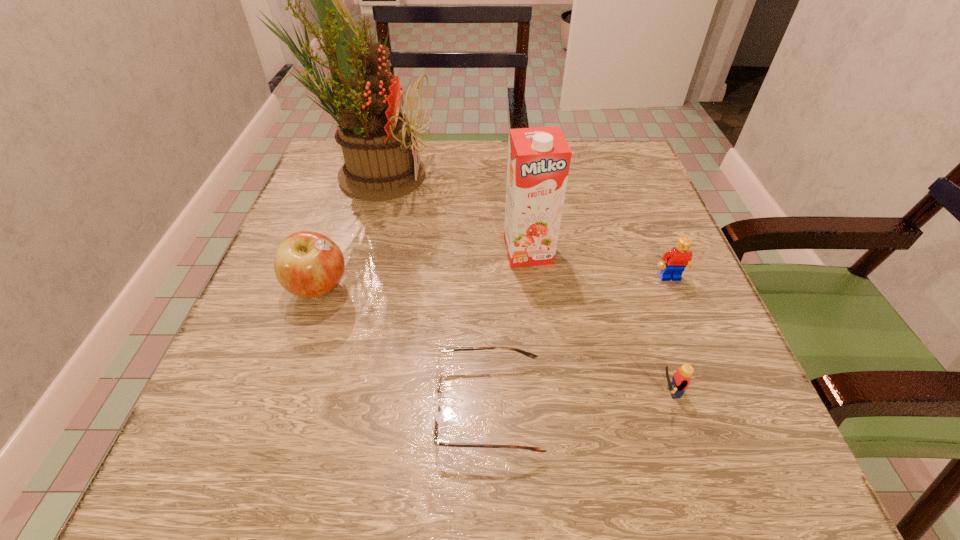
What are the coordinates of `object that is at the near edge` in the screenshot? It's located at 436,410.

Where is `flower arrangement at the left edge`? This screenshot has height=540, width=960. flower arrangement at the left edge is located at coordinates click(376, 138).

The image size is (960, 540). In order to click on apple that is at the left edge in this screenshot , I will do `click(307, 264)`.

At what (x,y) coordinates should I click in order to perform the action: click on object present at the far left corner. Please return your answer as a coordinate pair (x, y). This screenshot has width=960, height=540. Looking at the image, I should click on (376, 138).

The height and width of the screenshot is (540, 960). I want to click on free region at the far edge of the desktop, so click(x=461, y=157).

Find the location of `free space at the near edge`. free space at the near edge is located at coordinates (x=637, y=480).

This screenshot has height=540, width=960. What are the coordinates of `vacant space at the left edge` in the screenshot? It's located at (270, 429).

The height and width of the screenshot is (540, 960). What are the coordinates of `free space at the right edge` in the screenshot? It's located at (672, 240).

Where is `free space at the far left corner of the desktop`? free space at the far left corner of the desktop is located at coordinates (315, 176).

Where is `free space at the far right corner`? Image resolution: width=960 pixels, height=540 pixels. free space at the far right corner is located at coordinates (608, 150).